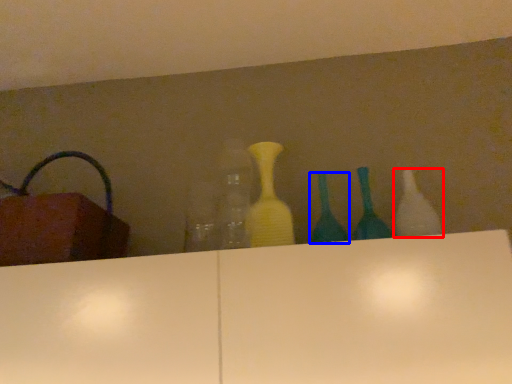
Question: Which object is further to the camera taking this photo, bottle (highlighted by a red box) or bottle (highlighted by a blue box)?

Choices:
 (A) bottle
 (B) bottle

Answer: (B)